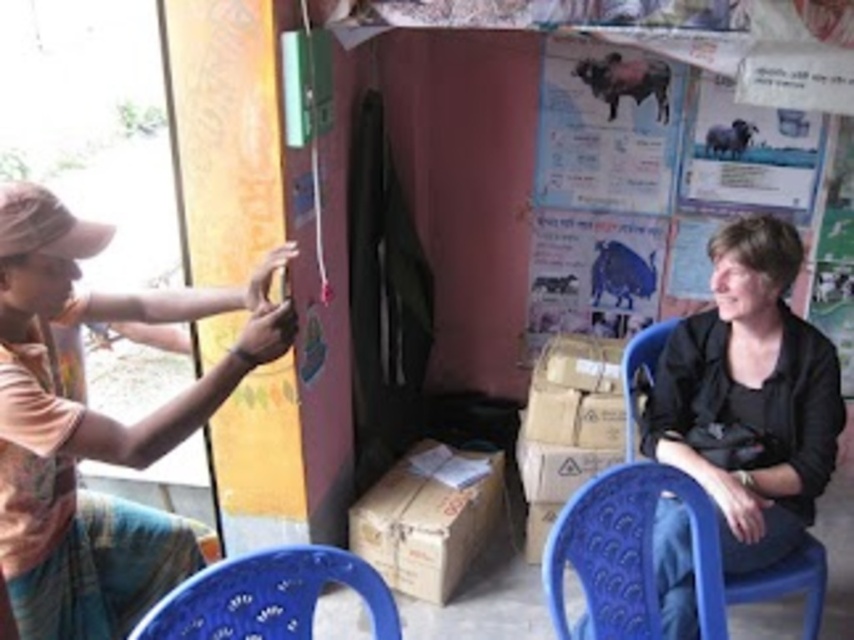
What do you see at coordinates (749, 396) in the screenshot? I see `black matte jacket at lower right` at bounding box center [749, 396].

Which is behind, point (785, 368) or point (395, 625)?

The point (785, 368) is behind.

The image size is (854, 640). I want to click on black matte jacket at lower right, so click(749, 396).

Which of these two, blue plastic chair at lower right or blue plastic chair at lower center, stands taller?

blue plastic chair at lower right

Does blue plastic chair at lower right appear on the left side of blue plastic chair at lower center?

Incorrect, blue plastic chair at lower right is not on the left side of blue plastic chair at lower center.

Does point (804, 536) come closer to viewer compared to point (376, 611)?

No, (804, 536) is behind (376, 611).

The width and height of the screenshot is (854, 640). What are the coordinates of `blue plastic chair at lower right` in the screenshot? It's located at (653, 557).

Does black matte jacket at lower right appear over blue plastic chair at lower right?

Yes.

Is black matte jacket at lower right thinner than blue plastic chair at lower right?

Correct, black matte jacket at lower right's width is less than blue plastic chair at lower right's.

Is point (793, 360) closer to viewer compared to point (613, 579)?

No, it is not.

Image resolution: width=854 pixels, height=640 pixels. I want to click on black matte jacket at lower right, so click(749, 396).